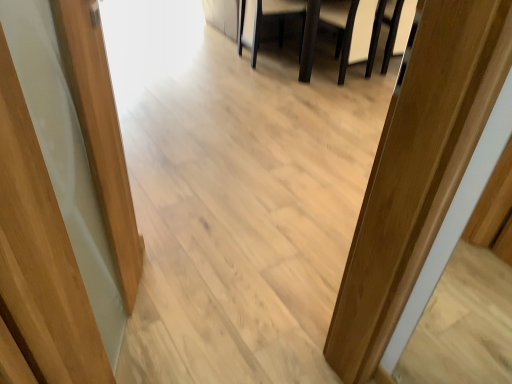
This screenshot has height=384, width=512. I want to click on vacant space in front of dark brown leather armchair at center, the first armchair in the left-to-right sequence, so click(266, 84).